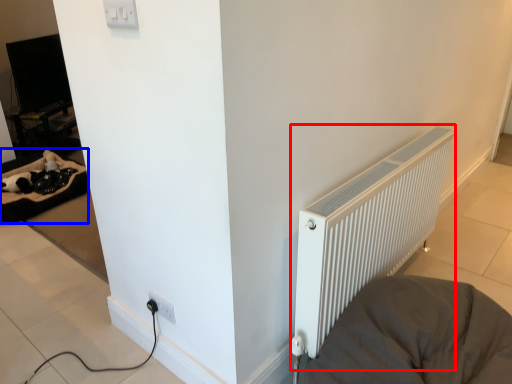
Question: Which object is closer to the camera taking this photo, radiator (highlighted by a red box) or bedding (highlighted by a blue box)?

Choices:
 (A) radiator
 (B) bedding

Answer: (A)